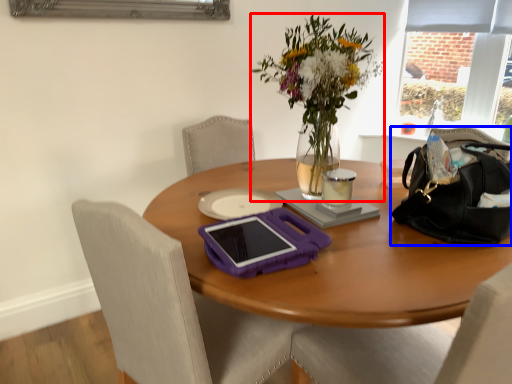
Question: Which of the following is the farthest to the observer, flower (highlighted by a red box) or handbag (highlighted by a blue box)?

Choices:
 (A) flower
 (B) handbag

Answer: (B)